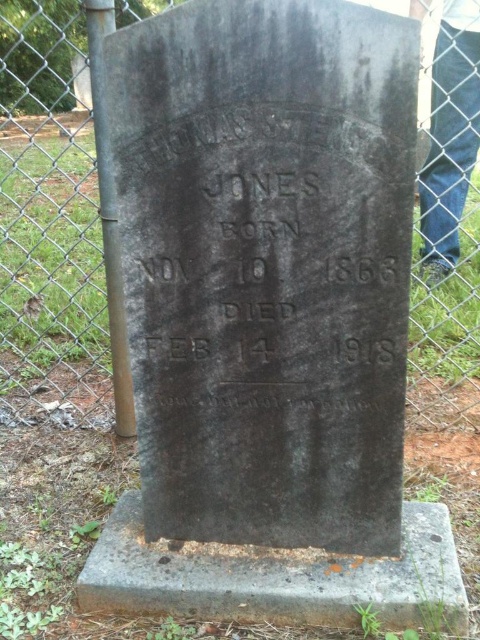
Between point (34, 196) and point (206, 547), which one is positioned in front?

Point (206, 547)

Is metal chain-link fence at upper left shorter than dark gray stone gravestone at center?

In fact, metal chain-link fence at upper left may be taller than dark gray stone gravestone at center.

Measure the distance between point (101, 368) and camera.

Point (101, 368) and camera are 9.98 feet apart.

Where is `metal chain-link fence at upper left`? The height and width of the screenshot is (640, 480). metal chain-link fence at upper left is located at coordinates (49, 224).